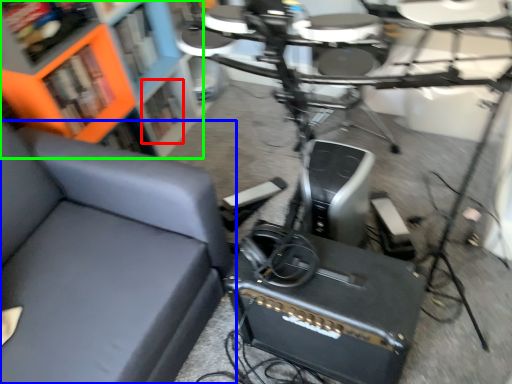
Question: Which is farther away from shelf (highlighted by a red box)? chair (highlighted by a blue box) or bookcase (highlighted by a green box)?

Choices:
 (A) chair
 (B) bookcase

Answer: (A)